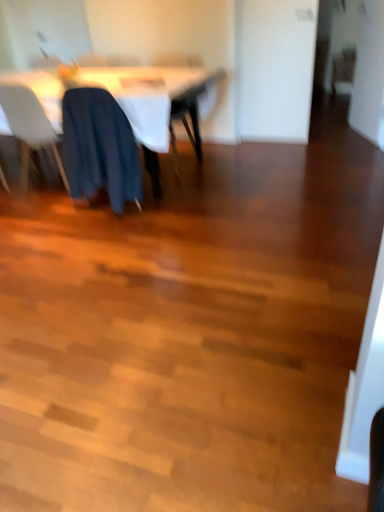
Question: In terms of size, does wooden chair at upper right, which ranks as the 1th chair in right-to-left order, appear bigger or smaller than white plastic chair at left, marked as the first chair in a left-to-right arrangement?

Choices:
 (A) big
 (B) small

Answer: (B)

Question: Is wooden chair at upper right, which ranks as the 1th chair in right-to-left order, spatially inside white plastic chair at left, positioned as the third chair in back-to-front order, or outside of it?

Choices:
 (A) inside
 (B) outside

Answer: (B)

Question: Which object is positioned farthest from the wooden chair at upper right, which ranks as the 1th chair in right-to-left order?

Choices:
 (A) white fabric table at upper left
 (B) white plastic chair at left, positioned as the third chair in back-to-front order
 (C) dark blue fabric at center, the first chair viewed from the front
 (D) dark blue fabric chair at center, positioned as the third chair in front-to-back order

Answer: (B)

Question: Estimate the real-world distances between objects in this image. Which object is closer to the wooden chair at upper right, which ranks as the 1th chair in right-to-left order?

Choices:
 (A) dark blue fabric at center, the first chair viewed from the front
 (B) dark blue fabric chair at center, acting as the second chair starting from the right
 (C) white fabric table at upper left
 (D) white plastic chair at left, positioned as the third chair in back-to-front order

Answer: (B)